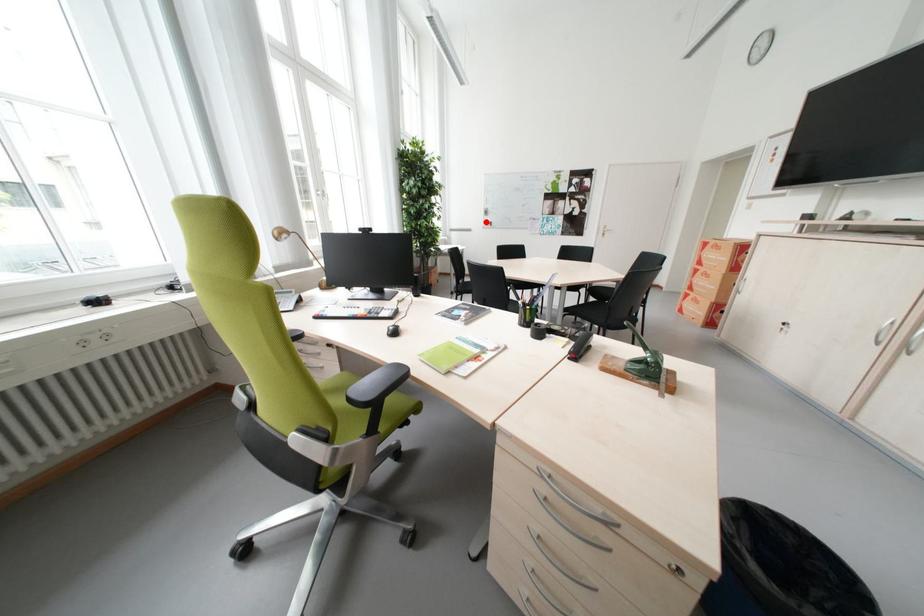
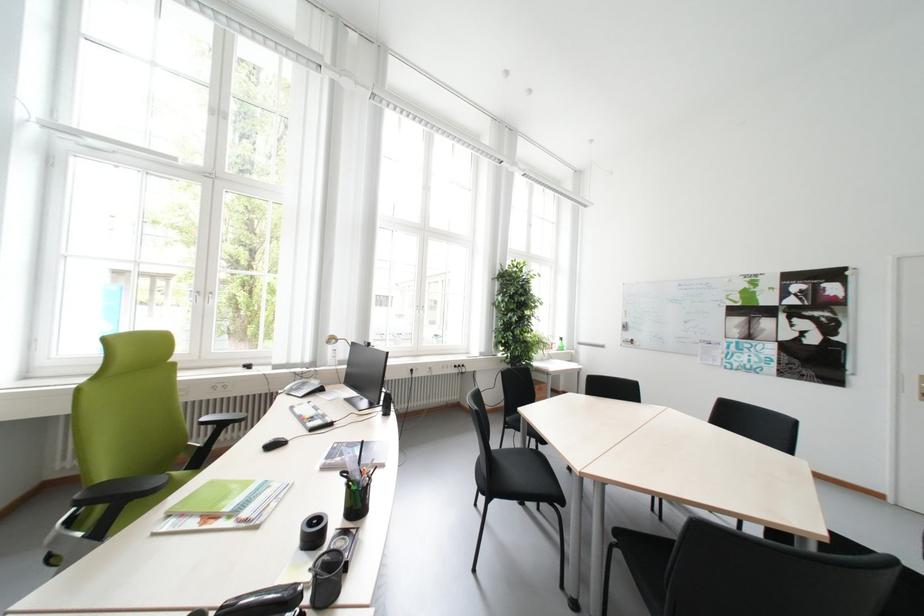
In the second image, find the point that corresponds to the highlighted location in the first image.

(621, 338)